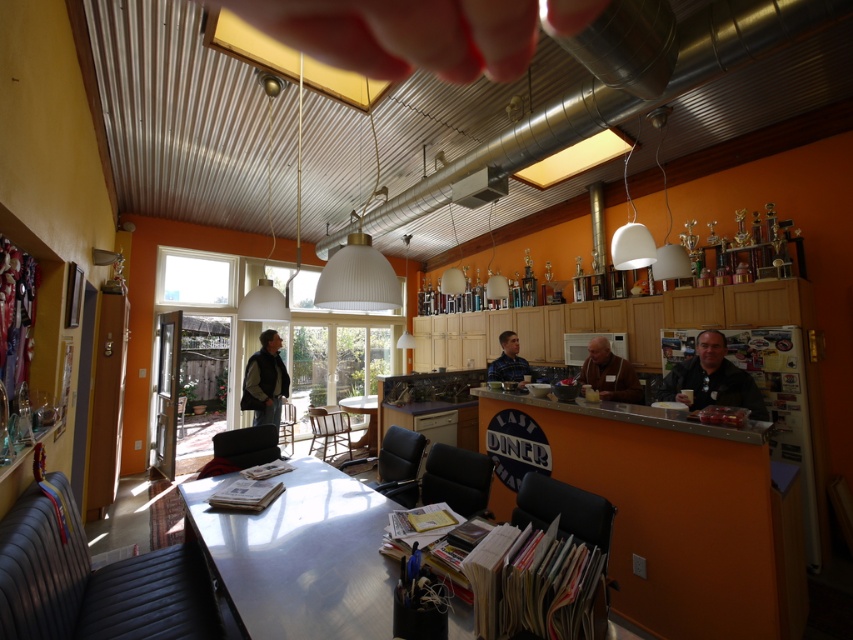
Question: Which of the following is the farthest from the observer?

Choices:
 (A) (245, 584)
 (B) (714, 355)
 (C) (357, 397)
 (D) (521, 380)

Answer: (C)

Question: Estimate the real-world distances between objects in this image. Which object is farther from the wooden table at center?

Choices:
 (A) brown leather jacket at center
 (B) dark gray vest at center
 (C) blue denim jacket at center

Answer: (A)

Question: Is blue denim jacket at center smaller than wooden table at center?

Choices:
 (A) no
 (B) yes

Answer: (B)

Question: Is dark brown leather jacket at bar counter bigger than brown leather jacket at center?

Choices:
 (A) yes
 (B) no

Answer: (A)

Question: Which of the following is the closest to the observer?

Choices:
 (A) (529, 369)
 (B) (515, 134)
 (C) (277, 426)

Answer: (B)

Question: In this image, where is metallic silver table at center located relative to dark brown leather jacket at bar counter?

Choices:
 (A) left
 (B) right

Answer: (A)